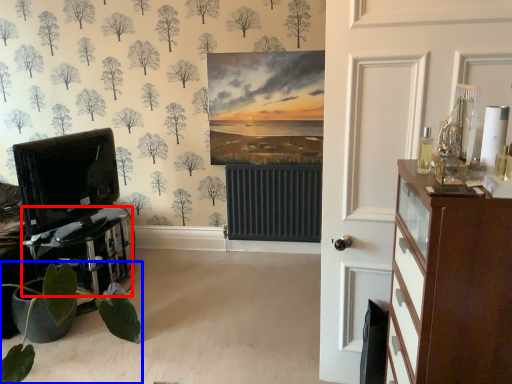
Question: Which point is further to the camera, table (highlighted by a red box) or houseplant (highlighted by a blue box)?

Choices:
 (A) table
 (B) houseplant

Answer: (A)